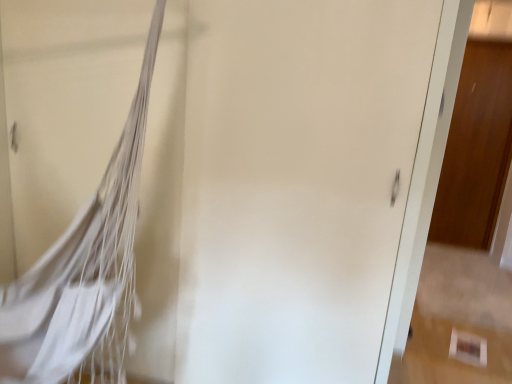
Question: Considering the positions of point (93, 357) and point (461, 69), is point (93, 357) closer or farther from the camera than point (461, 69)?

Choices:
 (A) closer
 (B) farther

Answer: (A)

Question: Is white fabric hammock at left bigger or smaller than wooden door at right?

Choices:
 (A) big
 (B) small

Answer: (A)

Question: Is white fabric hammock at left wider or thinner than wooden door at right?

Choices:
 (A) wide
 (B) thin

Answer: (A)

Question: Is wooden door at right taller or shorter than white fabric hammock at left?

Choices:
 (A) short
 (B) tall

Answer: (B)

Question: Is wooden door at right in front of or behind white fabric hammock at left in the image?

Choices:
 (A) front
 (B) behind

Answer: (B)

Question: From the image's perspective, is wooden door at right above or below white fabric hammock at left?

Choices:
 (A) below
 (B) above

Answer: (B)

Question: Choose the correct answer: Is wooden door at right inside white fabric hammock at left or outside it?

Choices:
 (A) inside
 (B) outside

Answer: (B)